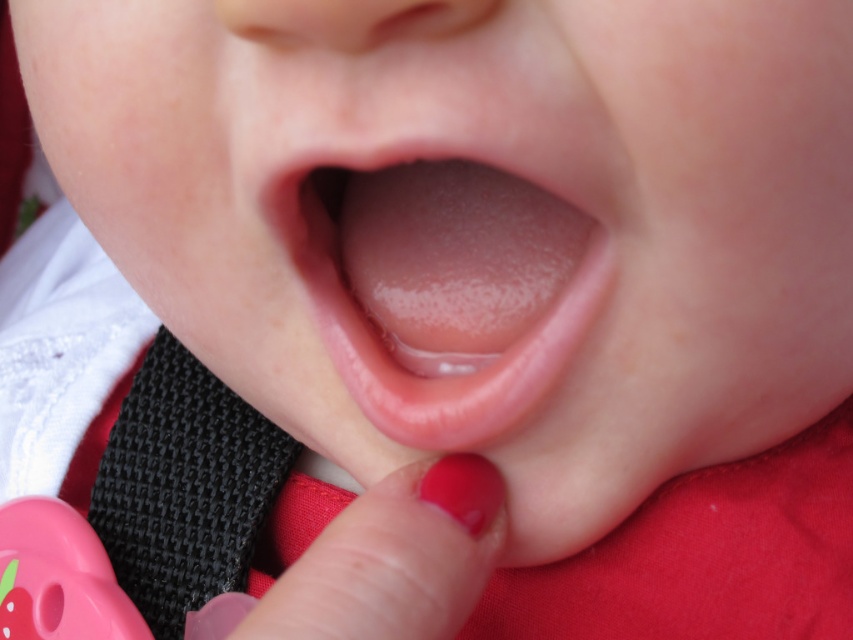
Question: Which object is farther from the camera taking this photo?

Choices:
 (A) glossy plastic teething ring at lower center
 (B) smooth pink tongue at center
 (C) black woven strap at lower left

Answer: (C)

Question: Is black woven strap at lower left further to the viewer compared to glossy plastic teething ring at lower center?

Choices:
 (A) no
 (B) yes

Answer: (B)

Question: Which point is closer to the camera?

Choices:
 (A) black woven strap at lower left
 (B) smooth pink tongue at center

Answer: (B)

Question: Considering the relative positions of black woven strap at lower left and glossy plastic teething ring at lower center in the image provided, where is black woven strap at lower left located with respect to glossy plastic teething ring at lower center?

Choices:
 (A) right
 (B) left

Answer: (B)

Question: In this image, where is black woven strap at lower left located relative to glossy plastic teething ring at lower center?

Choices:
 (A) left
 (B) right

Answer: (A)

Question: Which point is farther from the camera taking this photo?

Choices:
 (A) (604, 289)
 (B) (239, 586)
 (C) (502, 483)

Answer: (B)